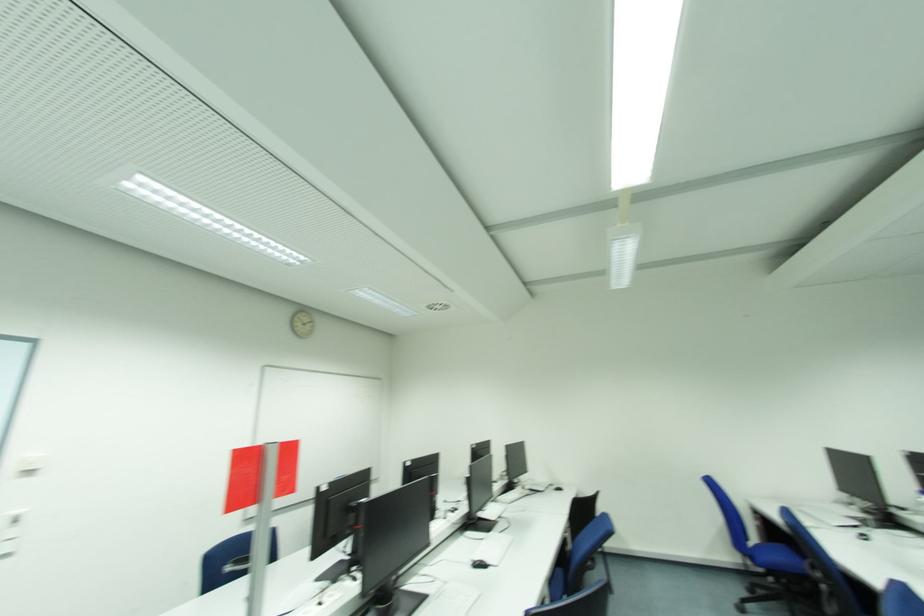
Locate an element on the screen. blue chair sitting surface is located at coordinates (771, 554).